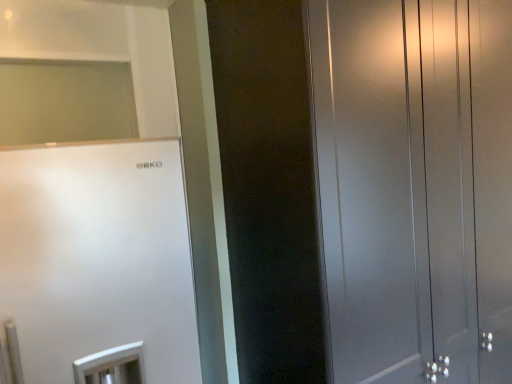
Question: From a real-world perspective, is satin white fridge at left located beneath satin black wardrobe at right?

Choices:
 (A) yes
 (B) no

Answer: (A)

Question: Is satin white fridge at left next to satin black wardrobe at right?

Choices:
 (A) yes
 (B) no

Answer: (B)

Question: Is satin white fridge at left to the right of satin black wardrobe at right from the viewer's perspective?

Choices:
 (A) yes
 (B) no

Answer: (B)

Question: Is satin white fridge at left oriented towards satin black wardrobe at right?

Choices:
 (A) yes
 (B) no

Answer: (B)

Question: Is satin white fridge at left at the left side of satin black wardrobe at right?

Choices:
 (A) no
 (B) yes

Answer: (B)

Question: From the image's perspective, is satin white fridge at left over satin black wardrobe at right?

Choices:
 (A) yes
 (B) no

Answer: (B)

Question: Does satin black wardrobe at right have a smaller size compared to satin white fridge at left?

Choices:
 (A) yes
 (B) no

Answer: (B)

Question: From a real-world perspective, is satin black wardrobe at right physically below satin white fridge at left?

Choices:
 (A) no
 (B) yes

Answer: (A)

Question: From a real-world perspective, is satin black wardrobe at right on top of satin white fridge at left?

Choices:
 (A) yes
 (B) no

Answer: (A)

Question: Are satin black wardrobe at right and satin white fridge at left beside each other?

Choices:
 (A) no
 (B) yes

Answer: (A)

Question: Is satin black wardrobe at right at the left side of satin white fridge at left?

Choices:
 (A) no
 (B) yes

Answer: (A)

Question: From the image's perspective, is satin black wardrobe at right under satin white fridge at left?

Choices:
 (A) yes
 (B) no

Answer: (B)

Question: Is point (89, 377) closer or farther from the camera than point (417, 312)?

Choices:
 (A) closer
 (B) farther

Answer: (A)